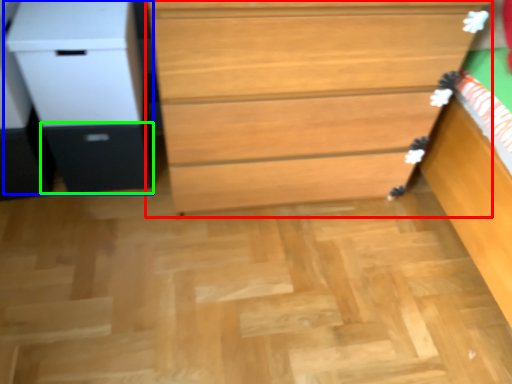
Question: Considering the real-world distances, which object is farthest from chest of drawers (highlighted by a red box)? file cabinet (highlighted by a blue box) or drawer (highlighted by a green box)?

Choices:
 (A) file cabinet
 (B) drawer

Answer: (B)